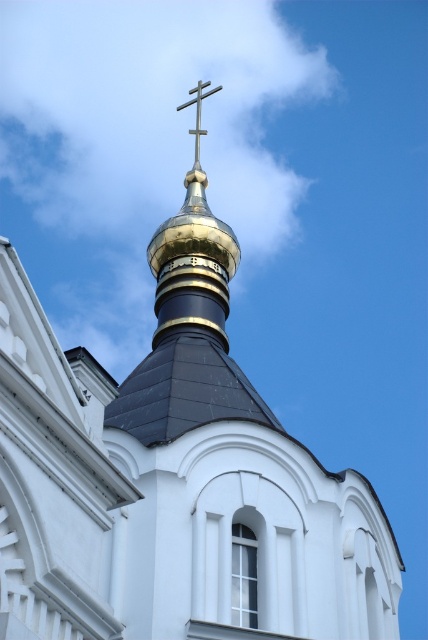
Question: Can you confirm if gold polished dome at upper center is positioned to the right of gold metallic cross at upper center?

Choices:
 (A) no
 (B) yes

Answer: (B)

Question: Which point appears farthest from the camera in this image?

Choices:
 (A) (210, 269)
 (B) (193, 100)

Answer: (B)

Question: Does gold polished dome at upper center have a larger size compared to gold metallic cross at upper center?

Choices:
 (A) no
 (B) yes

Answer: (B)

Question: Which point appears farthest from the camera in this image?

Choices:
 (A) (175, 224)
 (B) (196, 100)

Answer: (B)

Question: Where is gold polished dome at upper center located in relation to gold metallic cross at upper center in the image?

Choices:
 (A) left
 (B) right

Answer: (B)

Question: Which point is farther from the camera taking this photo?

Choices:
 (A) [x=214, y=88]
 (B) [x=204, y=204]

Answer: (A)